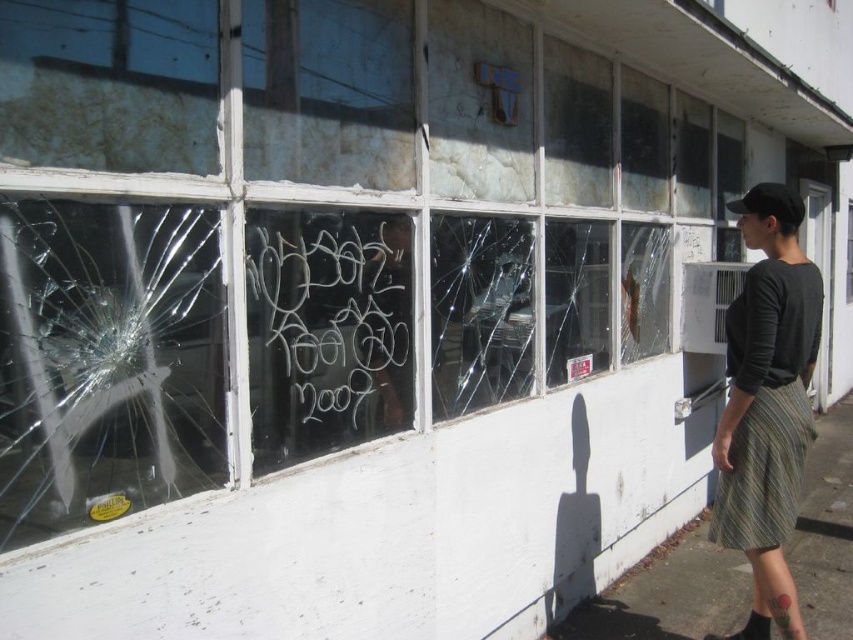
Which of these two, clear glass window at center or transparent glass window at center, stands taller?

Standing taller between the two is clear glass window at center.

In the scene shown: Which is more to the right, clear glass window at center or transparent glass window at center?

transparent glass window at center

Does point (473, 291) lie in front of point (544, 296)?

Yes.

At what (x,y) coordinates should I click in order to perform the action: click on clear glass window at center. Please return your answer as a coordinate pair (x, y). Looking at the image, I should click on (480, 310).

Between green striped skirt at right and transparent glass window at center, which one is positioned lower?

green striped skirt at right is lower down.

Consider the image. Who is more distant from viewer, (791, 611) or (555, 346)?

The point (555, 346) is behind.

The width and height of the screenshot is (853, 640). What are the coordinates of `green striped skirt at right` in the screenshot? It's located at (767, 403).

Does green striped skirt at right have a smaller size compared to clear glass window at center?

Actually, green striped skirt at right might be larger than clear glass window at center.

What do you see at coordinates (767, 403) in the screenshot? This screenshot has width=853, height=640. I see `green striped skirt at right` at bounding box center [767, 403].

Identify the location of green striped skirt at right. The image size is (853, 640). (767, 403).